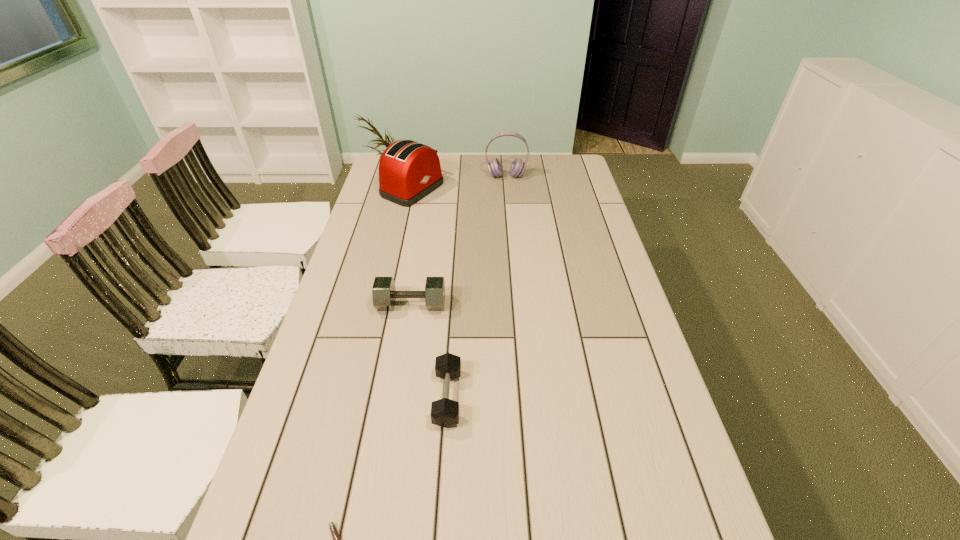
At what (x,y) coordinates should I click in order to perform the action: click on vacant space in between the rightmost object and the shorter dumbbell. Please return your answer as a coordinate pair (x, y). The image size is (960, 540). Looking at the image, I should click on (477, 287).

Locate an element on the screen. The width and height of the screenshot is (960, 540). free spot between the toaster and the rightmost object is located at coordinates (459, 183).

Find the location of a particular element. The image size is (960, 540). the fourth closest object to the toaster is located at coordinates (336, 538).

You are a GUI agent. You are given a task and a screenshot of the screen. Output one action in this format:
    pyautogui.click(x=<x>, y=<y>)
    Task: Click on the fourth closest object to the second shortest object
    This screenshot has height=540, width=960.
    Given the screenshot: What is the action you would take?
    pyautogui.click(x=517, y=168)